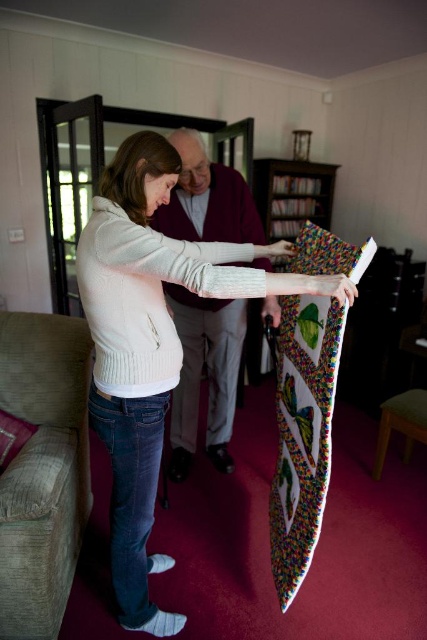
Question: Does white knit sweater at center appear on the right side of maroon sweater at center?

Choices:
 (A) no
 (B) yes

Answer: (A)

Question: Which point is farther to the camera?

Choices:
 (A) white knit sweater at center
 (B) maroon sweater at center

Answer: (B)

Question: Does white knit sweater at center come behind maroon sweater at center?

Choices:
 (A) no
 (B) yes

Answer: (A)

Question: Does white knit sweater at center appear on the left side of maroon sweater at center?

Choices:
 (A) yes
 (B) no

Answer: (A)